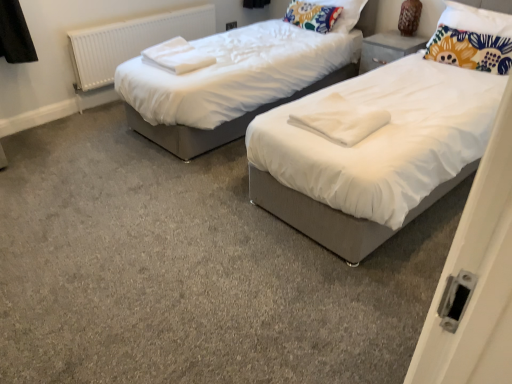
The width and height of the screenshot is (512, 384). What do you see at coordinates (176, 56) in the screenshot?
I see `white soft towels at upper left, the 1th linen in the back-to-front sequence` at bounding box center [176, 56].

Locate an element on the screen. floral fabric pillow at upper center, acting as the first pillow starting from the left is located at coordinates (344, 13).

This screenshot has width=512, height=384. What do you see at coordinates (472, 39) in the screenshot?
I see `floral fabric pillow at upper right, positioned as the first pillow in front-to-back order` at bounding box center [472, 39].

Where is `white soft towel at center, which is counted as the 2th linen, starting from the left`? The height and width of the screenshot is (384, 512). white soft towel at center, which is counted as the 2th linen, starting from the left is located at coordinates (340, 119).

At what (x,y) coordinates should I click in order to perform the action: click on matte gray nightstand at upper right. Please return your answer as a coordinate pair (x, y). Looking at the image, I should click on (387, 49).

Is floral fabric pillow at upper center, placed as the 2th pillow when sorted from right to left, looking in the opposite direction of matte gray nightstand at upper right?

No, floral fabric pillow at upper center, placed as the 2th pillow when sorted from right to left,'s orientation is not away from matte gray nightstand at upper right.

Is floral fabric pillow at upper center, acting as the first pillow starting from the left, positioned beyond the bounds of matte gray nightstand at upper right?

floral fabric pillow at upper center, acting as the first pillow starting from the left, is positioned outside matte gray nightstand at upper right.

How much distance is there between floral fabric pillow at upper center, acting as the first pillow starting from the left, and matte gray nightstand at upper right?

floral fabric pillow at upper center, acting as the first pillow starting from the left, and matte gray nightstand at upper right are 16.39 inches apart from each other.

Considering the sizes of objects floral fabric pillow at upper center, acting as the first pillow starting from the left, and matte gray nightstand at upper right in the image provided, who is bigger, floral fabric pillow at upper center, acting as the first pillow starting from the left, or matte gray nightstand at upper right?

Bigger between the two is floral fabric pillow at upper center, acting as the first pillow starting from the left.

Looking at this image, from the image's perspective, is white soft towel at center, which is counted as the 1th linen, starting from the bottom, located above or below white soft towels at upper left, the 2th linen viewed from the right?

white soft towel at center, which is counted as the 1th linen, starting from the bottom, is situated lower than white soft towels at upper left, the 2th linen viewed from the right, in the image.

In the scene shown: Is white soft towel at center, which ranks as the second linen in back-to-front order, not within white soft towels at upper left, the 2th linen viewed from the right?

white soft towel at center, which ranks as the second linen in back-to-front order, lies outside white soft towels at upper left, the 2th linen viewed from the right,'s area.

In terms of size, does white soft towel at center, acting as the 2th linen starting from the top, appear bigger or smaller than white soft towels at upper left, the 1th linen in the back-to-front sequence?

Clearly, white soft towel at center, acting as the 2th linen starting from the top, is smaller in size than white soft towels at upper left, the 1th linen in the back-to-front sequence.

Can you tell me how much white soft towel at center, the 1th linen viewed from the front, and white soft towels at upper left, the 2th linen in the bottom-to-top sequence, differ in facing direction?

1.17 degrees separate the facing orientations of white soft towel at center, the 1th linen viewed from the front, and white soft towels at upper left, the 2th linen in the bottom-to-top sequence.

From the image's perspective, does white soft towels at upper left, positioned as the 2th linen in front-to-back order, appear higher than white plastic radiator at left?

No.

Is point (211, 57) less distant than point (80, 74)?

Yes, point (211, 57) is in front of point (80, 74).

Which of these two, white soft towels at upper left, positioned as the 2th linen in front-to-back order, or white plastic radiator at left, is thinner?

white plastic radiator at left.

Is white soft towels at upper left, positioned as the 2th linen in front-to-back order, looking in the opposite direction of white plastic radiator at left?

No, white soft towels at upper left, positioned as the 2th linen in front-to-back order, is not facing the opposite direction of white plastic radiator at left.

Is floral fabric pillow at upper center, acting as the first pillow starting from the left, looking in the opposite direction of floral fabric pillow at upper right, the 2th pillow when ordered from back to front?

No, floral fabric pillow at upper center, acting as the first pillow starting from the left, is not facing the opposite direction of floral fabric pillow at upper right, the 2th pillow when ordered from back to front.

How many degrees apart are the facing directions of floral fabric pillow at upper center, placed as the 2th pillow when sorted from right to left, and floral fabric pillow at upper right, the second pillow from the left?

5.98 degrees separate the facing orientations of floral fabric pillow at upper center, placed as the 2th pillow when sorted from right to left, and floral fabric pillow at upper right, the second pillow from the left.

Measure the distance between floral fabric pillow at upper center, which ranks as the second pillow in front-to-back order, and floral fabric pillow at upper right, placed as the 1th pillow when sorted from right to left.

floral fabric pillow at upper center, which ranks as the second pillow in front-to-back order, and floral fabric pillow at upper right, placed as the 1th pillow when sorted from right to left, are 3.34 feet apart.

Is floral fabric pillow at upper center, acting as the first pillow starting from the left, directly adjacent to floral fabric pillow at upper right, positioned as the first pillow in front-to-back order?

floral fabric pillow at upper center, acting as the first pillow starting from the left, is not next to floral fabric pillow at upper right, positioned as the first pillow in front-to-back order, and they're not touching.

Based on the photo, does white soft towel at center, which is counted as the 1th linen, starting from the bottom, come behind matte gray nightstand at upper right?

No, it is not.

Can you confirm if white soft towel at center, which is counted as the 1th linen, starting from the bottom, is positioned to the right of matte gray nightstand at upper right?

No, white soft towel at center, which is counted as the 1th linen, starting from the bottom, is not to the right of matte gray nightstand at upper right.

From the image's perspective, is white soft towel at center, acting as the 2th linen starting from the top, positioned above or below matte gray nightstand at upper right?

white soft towel at center, acting as the 2th linen starting from the top, is below matte gray nightstand at upper right.

Consider the image. Are matte gray nightstand at upper right and white plastic radiator at left beside each other?

No, matte gray nightstand at upper right is not next to white plastic radiator at left.

In the image, there is a white plastic radiator at left. What are the coordinates of `nightstand below it (from the image's perspective)` in the screenshot? It's located at pyautogui.click(x=387, y=49).

Could you tell me if matte gray nightstand at upper right is turned towards white plastic radiator at left?

No, matte gray nightstand at upper right is not turned towards white plastic radiator at left.

Considering the sizes of objects white plastic radiator at left and floral fabric pillow at upper center, which ranks as the second pillow in front-to-back order, in the image provided, who is shorter, white plastic radiator at left or floral fabric pillow at upper center, which ranks as the second pillow in front-to-back order,?

Standing shorter between the two is floral fabric pillow at upper center, which ranks as the second pillow in front-to-back order.

Does point (178, 12) appear closer or farther from the camera than point (359, 3)?

Point (178, 12).

This screenshot has height=384, width=512. I want to click on pillow above the white plastic radiator at left (from the image's perspective), so click(x=344, y=13).

How far apart are white plastic radiator at left and floral fabric pillow at upper center, which ranks as the second pillow in front-to-back order?

white plastic radiator at left and floral fabric pillow at upper center, which ranks as the second pillow in front-to-back order, are 1.54 meters apart.

Identify the location of nightstand that is in front of the floral fabric pillow at upper center, which is counted as the first pillow, starting from the back. This screenshot has width=512, height=384. (387, 49).

Find the location of a particular element. linen that is on the left side of white soft towel at center, acting as the 2th linen starting from the top is located at coordinates (176, 56).

Based on their spatial positions, is floral fabric pillow at upper center, which is counted as the first pillow, starting from the back, or white soft towels at upper left, the 1th linen in the back-to-front sequence, closer to matte gray nightstand at upper right?

floral fabric pillow at upper center, which is counted as the first pillow, starting from the back, lies closer to matte gray nightstand at upper right than the other object.

From the picture: Looking at the image, which one is located closer to floral fabric pillow at upper center, acting as the first pillow starting from the left, white soft towel at center, the 1th linen viewed from the front, or white plastic radiator at left?

The object closer to floral fabric pillow at upper center, acting as the first pillow starting from the left, is white plastic radiator at left.

In the scene shown: From the image, which object appears to be nearer to white soft towel at center, which ranks as the second linen in back-to-front order, white plastic radiator at left or matte gray nightstand at upper right?

matte gray nightstand at upper right.

Looking at this image, when comparing their distances from white soft towels at upper left, positioned as the 2th linen in front-to-back order, does matte gray nightstand at upper right or floral fabric pillow at upper center, acting as the first pillow starting from the left, seem closer?

floral fabric pillow at upper center, acting as the first pillow starting from the left.

Looking at the image, which one is located further to white plastic radiator at left, white soft towel at center, the 1th linen viewed from the front, or floral fabric pillow at upper right, placed as the 1th pillow when sorted from right to left?

Among the two, floral fabric pillow at upper right, placed as the 1th pillow when sorted from right to left, is located further to white plastic radiator at left.

Which object lies nearer to the anchor point white soft towel at center, which is counted as the 2th linen, starting from the left, white soft towels at upper left, positioned as the 2th linen in front-to-back order, or floral fabric pillow at upper right, placed as the 1th pillow when sorted from right to left?

The object closer to white soft towel at center, which is counted as the 2th linen, starting from the left, is white soft towels at upper left, positioned as the 2th linen in front-to-back order.

From the image, which object appears to be farther from white plastic radiator at left, floral fabric pillow at upper center, which is counted as the first pillow, starting from the back, or white soft towel at center, which is counted as the 2th linen, starting from the left?

white soft towel at center, which is counted as the 2th linen, starting from the left.

Looking at the image, which one is located further to white soft towels at upper left, the 1th linen in the back-to-front sequence, floral fabric pillow at upper right, the 2th pillow when ordered from back to front, or matte gray nightstand at upper right?

floral fabric pillow at upper right, the 2th pillow when ordered from back to front, is positioned further to the anchor white soft towels at upper left, the 1th linen in the back-to-front sequence.

Identify the location of nightstand between white plastic radiator at left and floral fabric pillow at upper right, placed as the 1th pillow when sorted from right to left, from left to right. (387, 49).

Where is `pillow between white soft towels at upper left, the 2th linen viewed from the right, and matte gray nightstand at upper right`? pillow between white soft towels at upper left, the 2th linen viewed from the right, and matte gray nightstand at upper right is located at coordinates (344, 13).

You are a GUI agent. You are given a task and a screenshot of the screen. Output one action in this format:
    pyautogui.click(x=<x>, y=<y>)
    Task: Click on the nightstand located between white soft towel at center, marked as the 1th linen in a right-to-left arrangement, and floral fabric pillow at upper center, placed as the 2th pillow when sorted from right to left, in the depth direction
    The width and height of the screenshot is (512, 384).
    Given the screenshot: What is the action you would take?
    pyautogui.click(x=387, y=49)

The image size is (512, 384). Find the location of `nightstand between white soft towels at upper left, positioned as the 2th linen in front-to-back order, and floral fabric pillow at upper right, positioned as the first pillow in front-to-back order, from left to right`. nightstand between white soft towels at upper left, positioned as the 2th linen in front-to-back order, and floral fabric pillow at upper right, positioned as the first pillow in front-to-back order, from left to right is located at coordinates (387, 49).